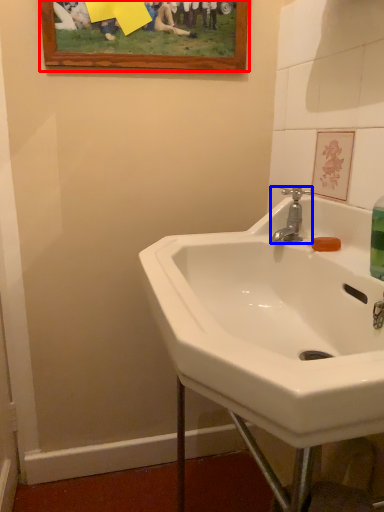
Question: Which object appears farthest to the camera in this image, picture frame (highlighted by a red box) or tap (highlighted by a blue box)?

Choices:
 (A) picture frame
 (B) tap

Answer: (A)